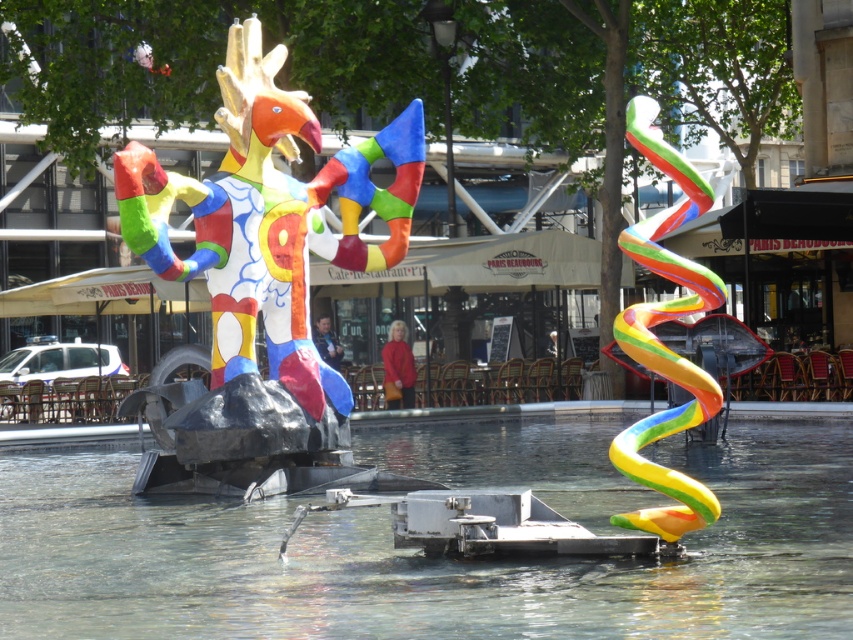
Question: Which point is farther to the camera?

Choices:
 (A) multicolored painted sculpture at center
 (B) clear glass water at center
 (C) rainbow rubber spiral at right

Answer: (A)

Question: Which point is farther from the camera taking this photo?

Choices:
 (A) (231, 541)
 (B) (664, 147)
 (C) (280, 346)

Answer: (C)

Question: Is multicolored painted sculpture at center to the left of rainbow rubber spiral at right from the viewer's perspective?

Choices:
 (A) no
 (B) yes

Answer: (B)

Question: Does multicolored painted sculpture at center come in front of rainbow rubber spiral at right?

Choices:
 (A) yes
 (B) no

Answer: (B)

Question: Which object is closer to the camera taking this photo?

Choices:
 (A) multicolored painted sculpture at center
 (B) clear glass water at center
 (C) rainbow rubber spiral at right

Answer: (B)

Question: Does multicolored painted sculpture at center come behind rainbow rubber spiral at right?

Choices:
 (A) no
 (B) yes

Answer: (B)